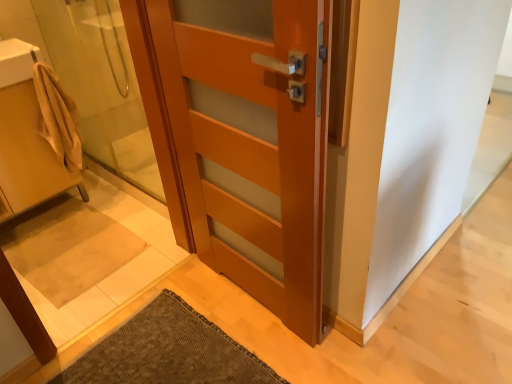
Question: From their relative heights in the image, would you say translucent glass shower door at left is taller or shorter than matte wood door at center?

Choices:
 (A) tall
 (B) short

Answer: (B)

Question: In terms of width, does translucent glass shower door at left look wider or thinner when compared to matte wood door at center?

Choices:
 (A) wide
 (B) thin

Answer: (B)

Question: Which of these objects is positioned closest to the beige fabric towel at left, which ranks as the first sink in bottom-to-top order?

Choices:
 (A) white glossy sink at upper left, which ranks as the second sink in bottom-to-top order
 (B) translucent glass shower door at left
 (C) beige fabric bath mat at lower left
 (D) beige cotton bathrobe at left
 (E) matte wood door at center

Answer: (D)

Question: Which object is positioned farthest from the matte wood door at center?

Choices:
 (A) beige fabric towel at left, which ranks as the first sink in bottom-to-top order
 (B) beige fabric bath mat at lower left
 (C) translucent glass shower door at left
 (D) white glossy sink at upper left, the first sink when ordered from top to bottom
 (E) beige cotton bathrobe at left

Answer: (D)